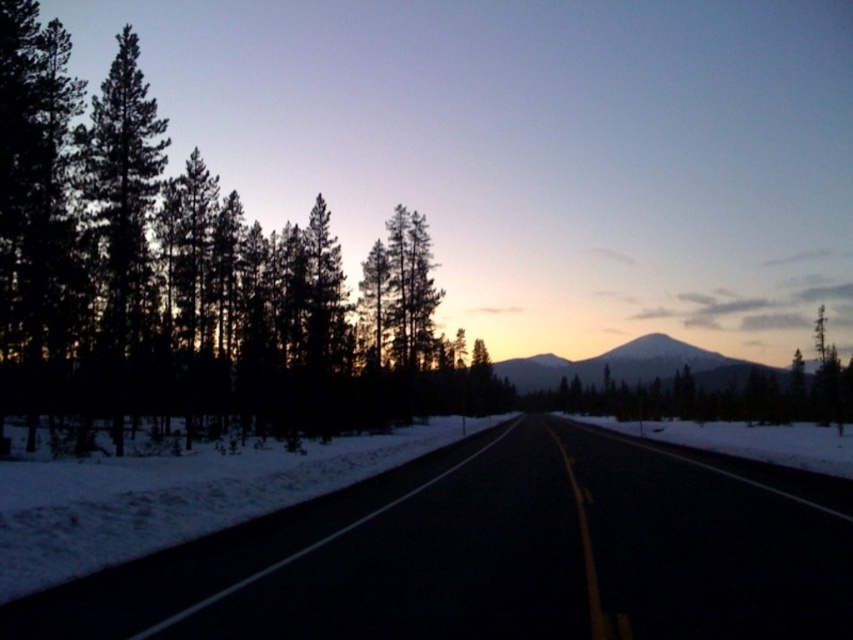
Between black asphalt road at center and smooth snow-covered mountain at center, which one is positioned lower?

smooth snow-covered mountain at center

Does black asphalt road at center appear under smooth snow-covered mountain at center?

No, black asphalt road at center is not below smooth snow-covered mountain at center.

The width and height of the screenshot is (853, 640). Describe the element at coordinates (498, 554) in the screenshot. I see `black asphalt road at center` at that location.

This screenshot has height=640, width=853. I want to click on black asphalt road at center, so click(x=498, y=554).

Between point (77, 397) and point (726, 369), which one is positioned behind?

The point (726, 369) is more distant.

What do you see at coordinates (183, 280) in the screenshot? I see `silky dark green trees at left` at bounding box center [183, 280].

Between point (321, 436) and point (535, 355), which one is positioned in front?

Point (321, 436) is in front.

Find the location of a particular element. The width and height of the screenshot is (853, 640). silky dark green trees at left is located at coordinates (183, 280).

Does black asphalt road at center have a greater height compared to silky dark green trees at left?

No, black asphalt road at center is not taller than silky dark green trees at left.

In the scene shown: Measure the distance between point (715, 572) and camera.

8.34 meters

You are a GUI agent. You are given a task and a screenshot of the screen. Output one action in this format:
    pyautogui.click(x=<x>, y=<y>)
    Task: Click on the black asphalt road at center
    This screenshot has height=640, width=853.
    Given the screenshot: What is the action you would take?
    pyautogui.click(x=498, y=554)